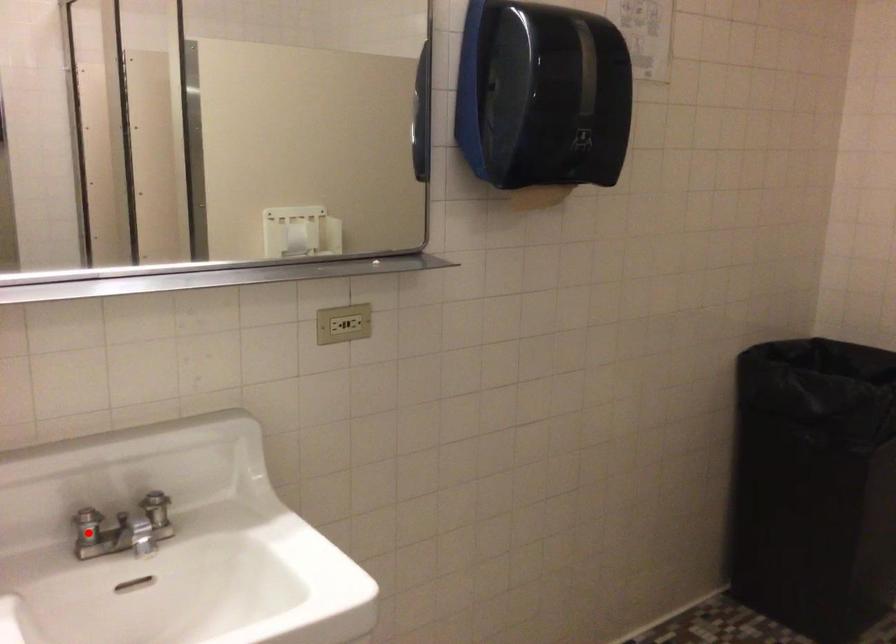
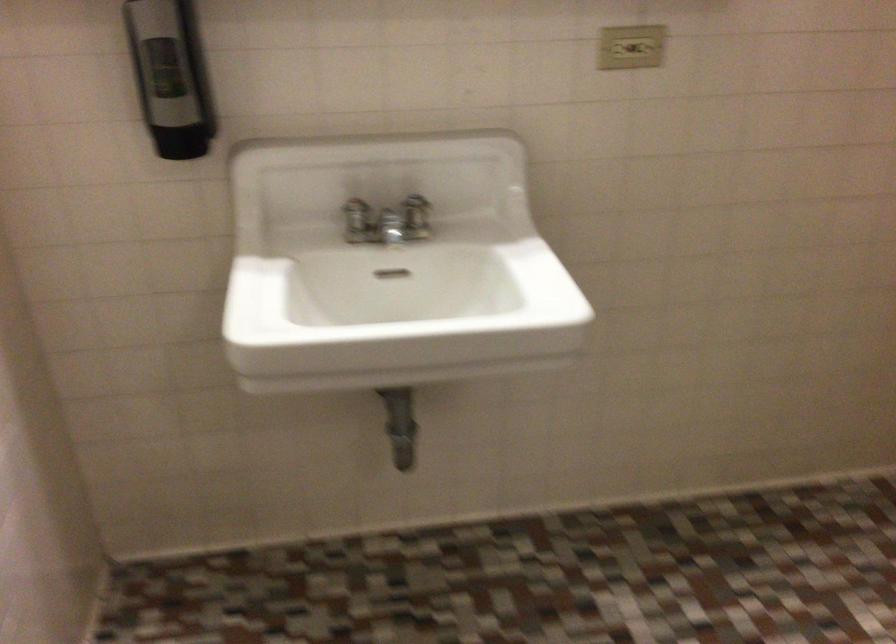
Question: I am providing you with two images of the same scene from different viewpoints. A red point is marked on the first image. Is the red point's position out of view in image 2?

Choices:
 (A) Yes
 (B) No

Answer: (B)